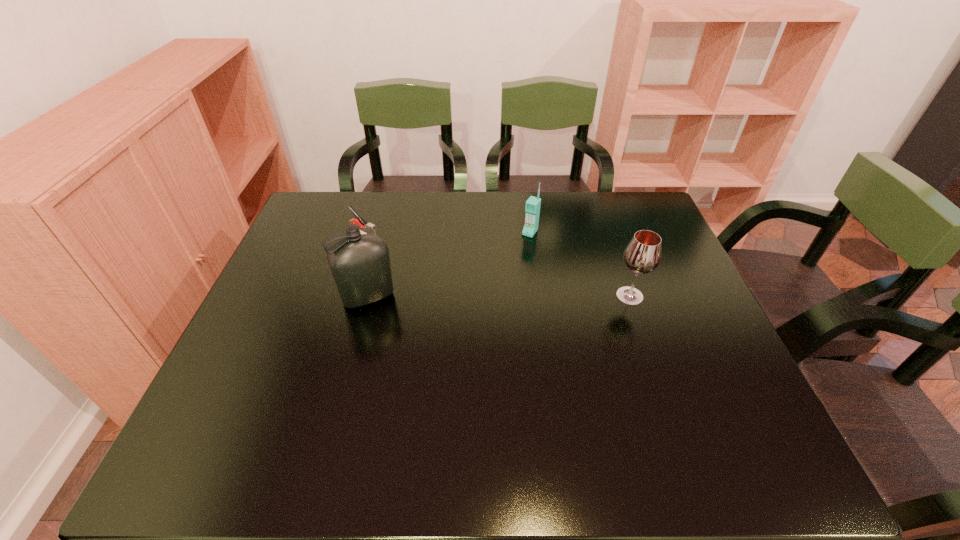
This screenshot has height=540, width=960. I want to click on free area in between the second object from right to left and the bottle, so click(x=449, y=265).

The width and height of the screenshot is (960, 540). I want to click on free spot between the rightmost object and the cellular telephone, so [580, 264].

Where is `vacant area that lies between the stapler and the rightmost object`? vacant area that lies between the stapler and the rightmost object is located at coordinates (496, 265).

Locate an element on the screen. Image resolution: width=960 pixels, height=540 pixels. free space that is in between the wineglass and the tallest object is located at coordinates click(x=499, y=296).

Image resolution: width=960 pixels, height=540 pixels. Find the location of `free space between the stapler and the cellular telephone`. free space between the stapler and the cellular telephone is located at coordinates (446, 234).

The height and width of the screenshot is (540, 960). Find the location of `free point between the wineglass and the tallest object`. free point between the wineglass and the tallest object is located at coordinates (499, 296).

The width and height of the screenshot is (960, 540). What are the coordinates of `free space between the stapler and the wineglass` in the screenshot? It's located at (496, 265).

What are the coordinates of `vacant area between the rightmost object and the tallest object` in the screenshot? It's located at (499, 296).

Locate an element on the screen. Image resolution: width=960 pixels, height=540 pixels. the second closest object to the rightmost object is located at coordinates (360, 264).

Identify which object is the third nearest to the stapler. Please provide its 2D coordinates. Your answer should be formatted as a tuple, i.e. [(x, y)], where the tuple contains the x and y coordinates of a point satisfying the conditions above.

[(642, 255)]